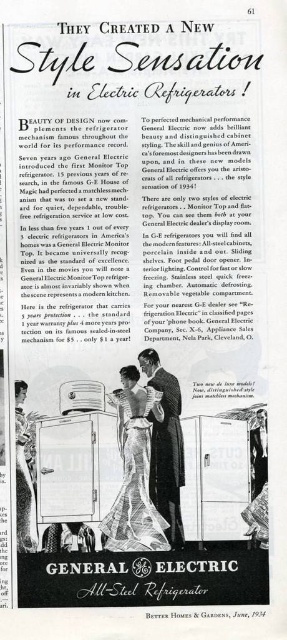
Does metallic silver trolley at center have a greater height compared to silky black suit at center?

In fact, metallic silver trolley at center may be shorter than silky black suit at center.

Looking at this image, measure the distance between metallic silver trolley at center and silky black suit at center.

They are 4.26 inches apart.

Is point (66, 545) in front of point (152, 362)?

Yes, point (66, 545) is closer to viewer.

You are a GUI agent. You are given a task and a screenshot of the screen. Output one action in this format:
    pyautogui.click(x=<x>, y=<y>)
    Task: Click on the metallic silver trolley at center
    This screenshot has width=287, height=640.
    Given the screenshot: What is the action you would take?
    pyautogui.click(x=78, y=458)